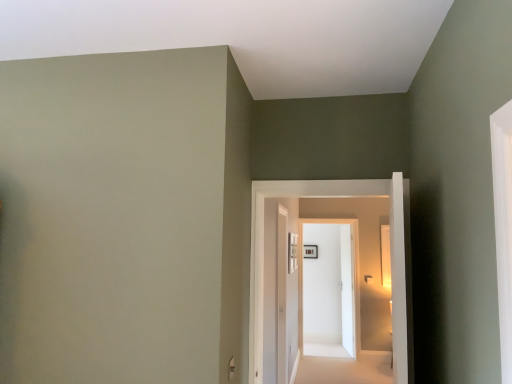
Question: From the image's perspective, is white carpet at center above or below wooden picture frame at center?

Choices:
 (A) above
 (B) below

Answer: (B)

Question: In terms of width, does white carpet at center look wider or thinner when compared to wooden picture frame at center?

Choices:
 (A) thin
 (B) wide

Answer: (B)

Question: Considering the real-world distances, which object is farthest from the clear glass window at center?

Choices:
 (A) wooden picture frame at center
 (B) white carpet at center
 (C) white glossy door at center, which is the second door from front to back
 (D) white glossy door at center, which appears as the 1th door when viewed from the front

Answer: (A)

Question: Which of these objects is positioned closest to the wooden picture frame at center?

Choices:
 (A) white glossy door at center, which is the second door from front to back
 (B) white carpet at center
 (C) clear glass window at center
 (D) white glossy door at center, which appears as the second door when viewed from the back

Answer: (A)